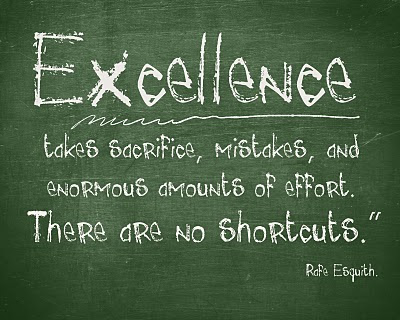
Locate an element on the screen. The height and width of the screenshot is (320, 400). light reflection on wall is located at coordinates (171, 39), (241, 40).